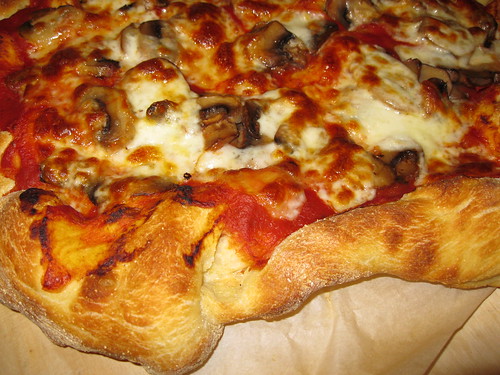
You are a GUI agent. You are given a task and a screenshot of the screen. Output one action in this format:
    pyautogui.click(x=<x>, y=<y>)
    Task: Click on the table
    
    Given the screenshot: What is the action you would take?
    pyautogui.click(x=325, y=346)